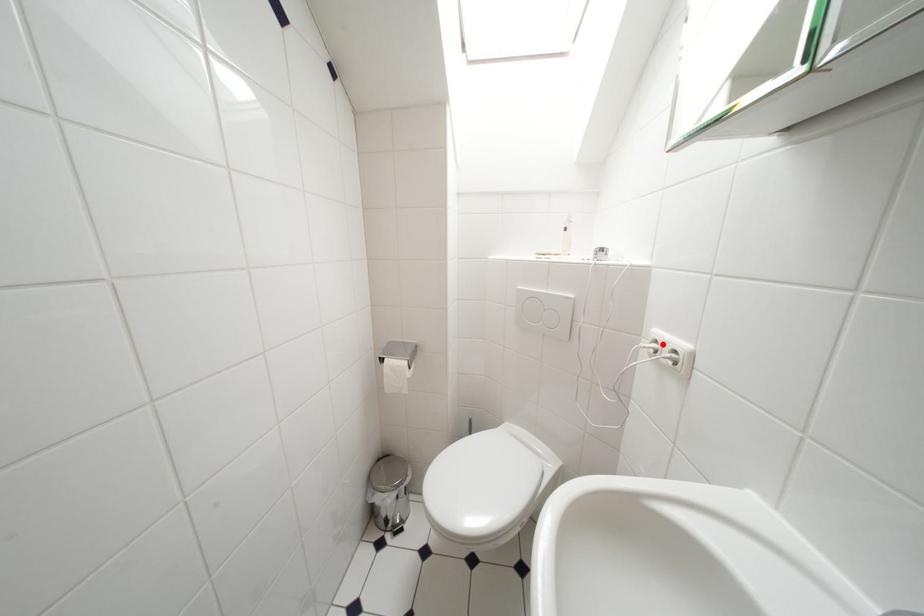
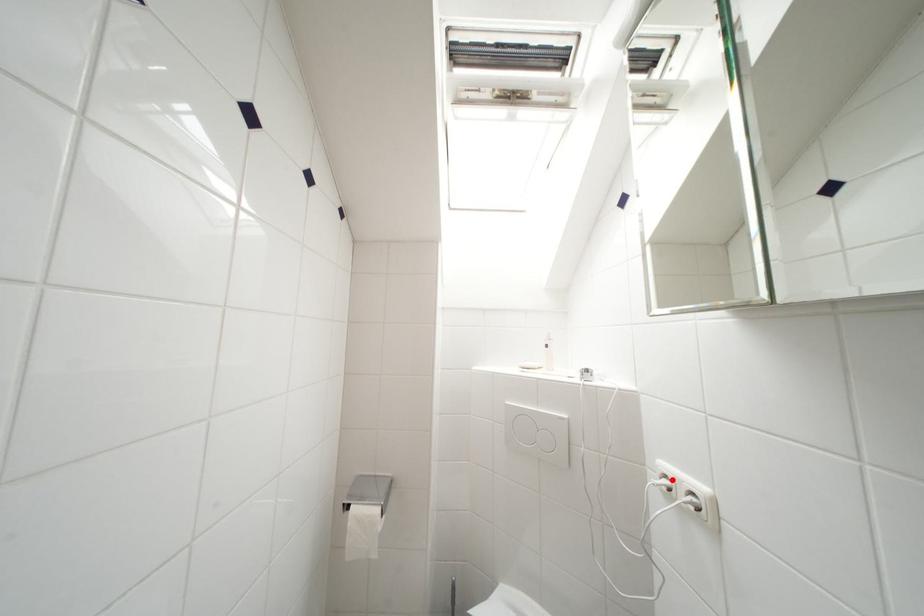
I am providing you with two images of the same scene from different viewpoints. A red point is marked on the first image and another point is marked on the second image. Does the point marked in image1 correspond to the same location as the one in image2?

Yes